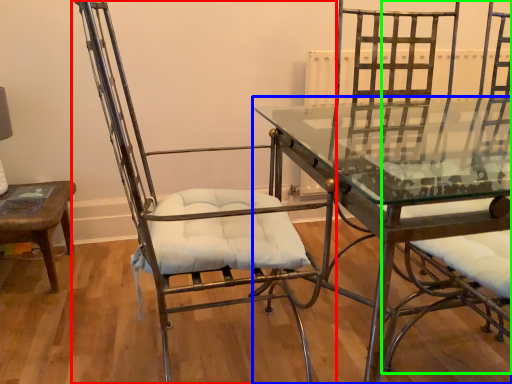
Question: Considering the real-world distances, which object is farthest from chair (highlighted by a red box)? table (highlighted by a blue box) or swivel chair (highlighted by a green box)?

Choices:
 (A) table
 (B) swivel chair

Answer: (B)